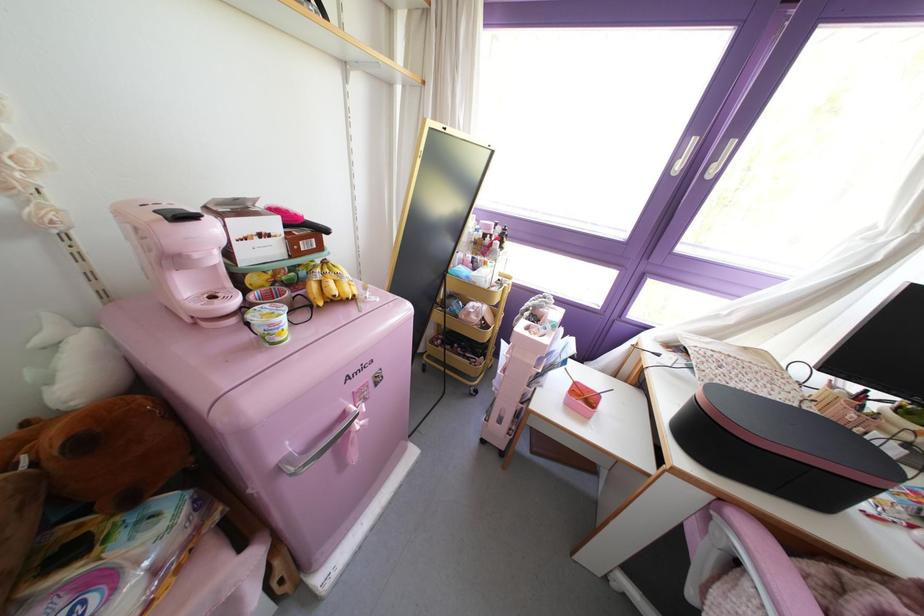
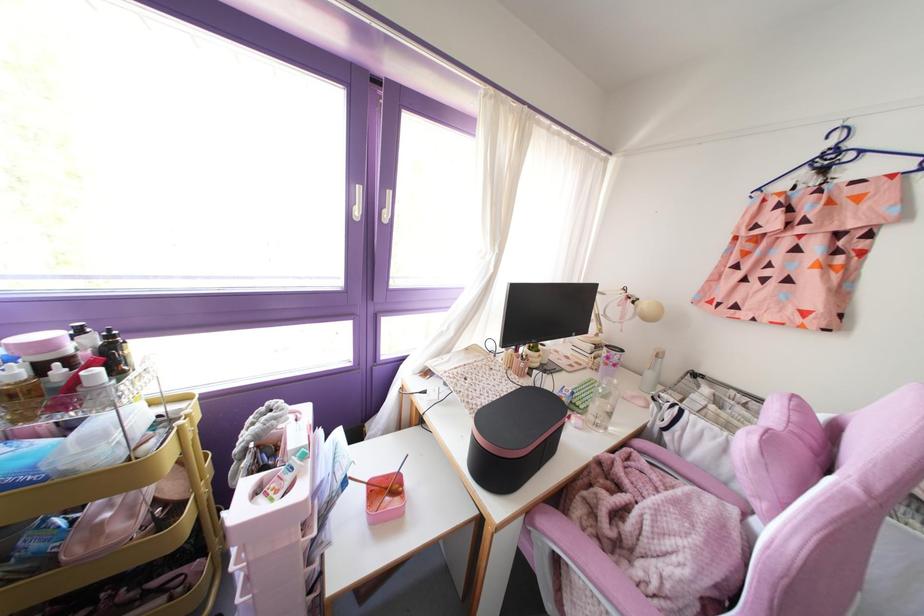
Locate, in the second image, the point that corresponds to the point at 677,167 in the first image.

(357, 212)